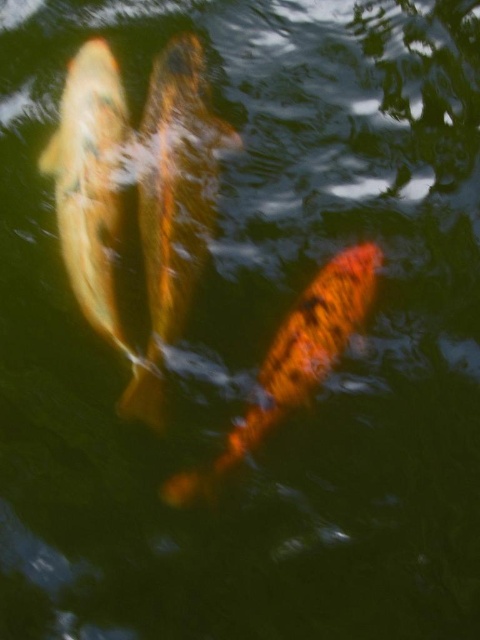
Question: Which point is closer to the camera?

Choices:
 (A) shiny orange fish at center
 (B) shiny gold fish at center
 (C) shiny gold fish at left

Answer: (A)

Question: Is shiny gold fish at center smaller than shiny orange fish at center?

Choices:
 (A) yes
 (B) no

Answer: (B)

Question: Which object is positioned farthest from the shiny orange fish at center?

Choices:
 (A) shiny gold fish at center
 (B) shiny gold fish at left

Answer: (B)

Question: Which object appears closest to the camera in this image?

Choices:
 (A) shiny gold fish at left
 (B) shiny orange fish at center
 (C) shiny gold fish at center

Answer: (B)

Question: From the image, what is the correct spatial relationship of shiny gold fish at left in relation to shiny orange fish at center?

Choices:
 (A) right
 (B) left

Answer: (B)

Question: Is shiny gold fish at center further to the viewer compared to shiny gold fish at left?

Choices:
 (A) yes
 (B) no

Answer: (A)